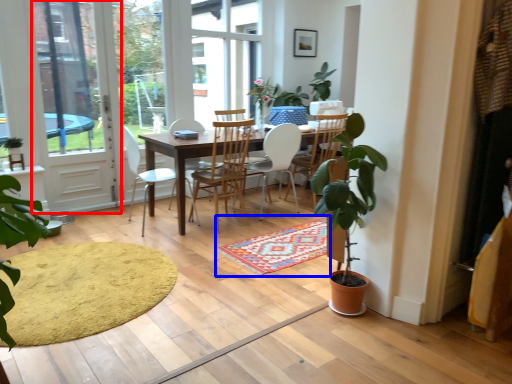
Question: Among these objects, which one is nearest to the camera, screen door (highlighted by a red box) or doormat (highlighted by a blue box)?

Choices:
 (A) screen door
 (B) doormat

Answer: (B)